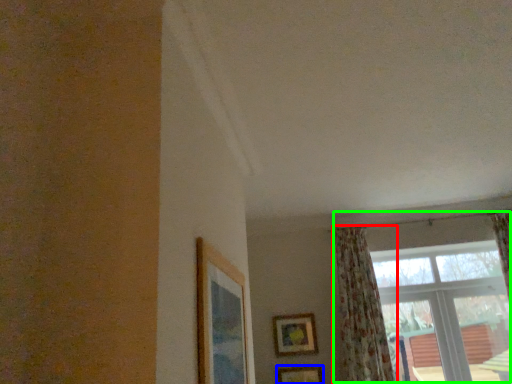
Question: Which object is positioned farthest from curtain (highlighted by a red box)? Select from picture frame (highlighted by a blue box) and window (highlighted by a green box).

Choices:
 (A) picture frame
 (B) window

Answer: (A)